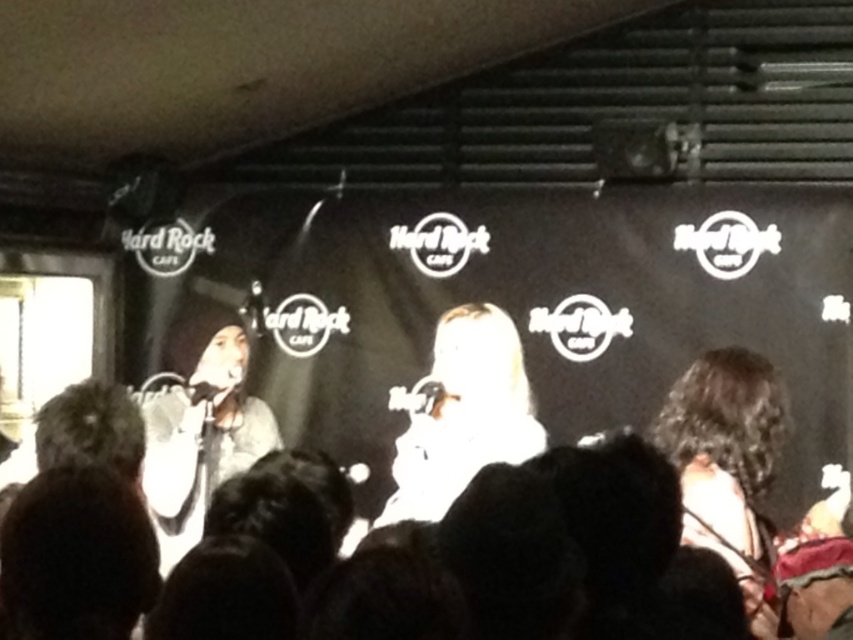
You are a photographer at the Hard Rock Cafe venue capturing the live performance. You notice the curly hair at right and the white matte microphone at center. Which object is shorter in height?

The curly hair at right has a lesser height compared to the white matte microphone at center, so the curly hair at right is shorter in height.

You are a sound technician in a Hard Rock Cafe venue. You need to adjust the volume of the microphone located at point [462,413]. Which performer should you approach, the one on the left wearing a light colored top or the one on the right in white?

The point [462,413] corresponds to the white matte microphone at center. Since the microphone is at the center, it is likely between both performers. However, the performer on the right in white is closer to the center microphone. Therefore, you should approach the performer on the right in white.